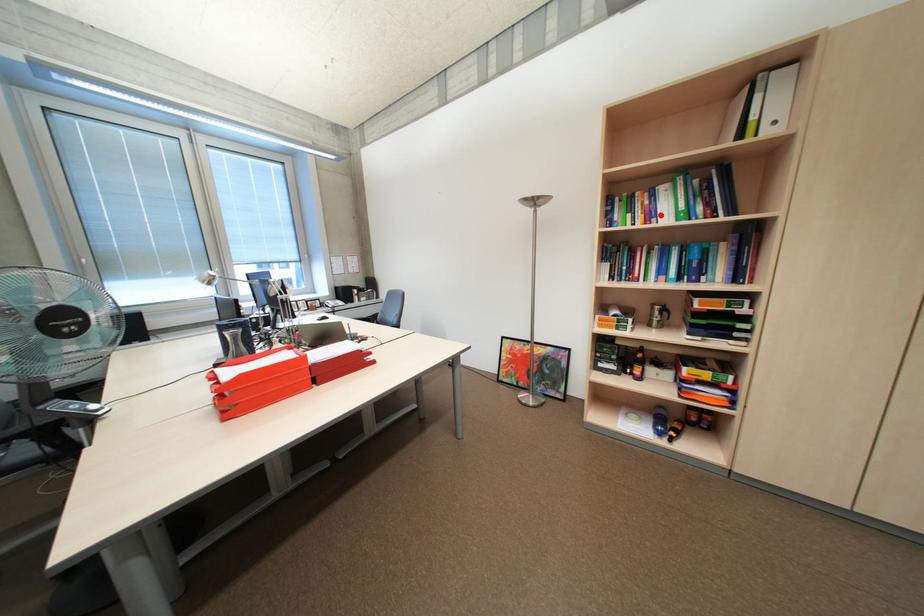
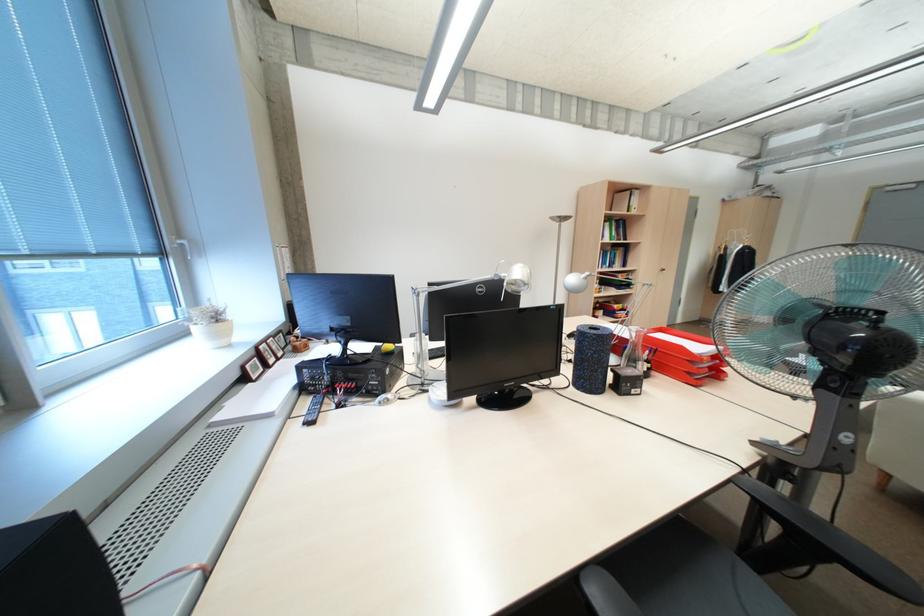
Find the pixel in the second image that matches the highlighted location in the first image.

(612, 236)